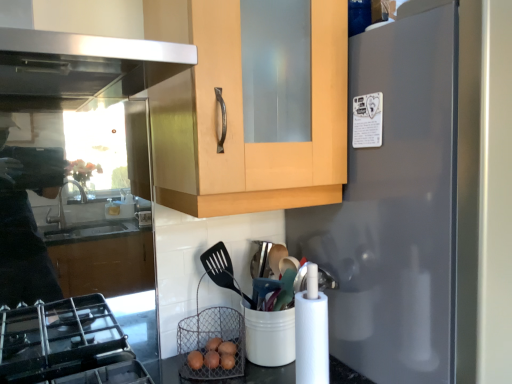
Question: Considering the relative sizes of satin gray refrigerator at right and brown wire basket at lower center in the image provided, is satin gray refrigerator at right wider than brown wire basket at lower center?

Choices:
 (A) no
 (B) yes

Answer: (B)

Question: From a real-world perspective, is satin gray refrigerator at right located beneath brown wire basket at lower center?

Choices:
 (A) no
 (B) yes

Answer: (A)

Question: Is satin gray refrigerator at right aimed at brown wire basket at lower center?

Choices:
 (A) no
 (B) yes

Answer: (A)

Question: Is satin gray refrigerator at right located outside brown wire basket at lower center?

Choices:
 (A) yes
 (B) no

Answer: (A)

Question: Considering the relative sizes of satin gray refrigerator at right and brown wire basket at lower center in the image provided, is satin gray refrigerator at right thinner than brown wire basket at lower center?

Choices:
 (A) no
 (B) yes

Answer: (A)

Question: Is satin gray refrigerator at right shorter than brown wire basket at lower center?

Choices:
 (A) no
 (B) yes

Answer: (A)

Question: From the image's perspective, is brown wire basket at lower center over satin gray refrigerator at right?

Choices:
 (A) no
 (B) yes

Answer: (A)

Question: From a real-world perspective, is brown wire basket at lower center on top of satin gray refrigerator at right?

Choices:
 (A) yes
 (B) no

Answer: (B)

Question: Is brown wire basket at lower center next to satin gray refrigerator at right?

Choices:
 (A) yes
 (B) no

Answer: (B)

Question: Does brown wire basket at lower center have a smaller size compared to satin gray refrigerator at right?

Choices:
 (A) no
 (B) yes

Answer: (B)

Question: From a real-world perspective, is brown wire basket at lower center physically below satin gray refrigerator at right?

Choices:
 (A) no
 (B) yes

Answer: (B)

Question: Can we say brown wire basket at lower center lies outside satin gray refrigerator at right?

Choices:
 (A) yes
 (B) no

Answer: (A)

Question: Considering the positions of brown wire basket at lower center and satin gray refrigerator at right in the image, is brown wire basket at lower center bigger or smaller than satin gray refrigerator at right?

Choices:
 (A) small
 (B) big

Answer: (A)